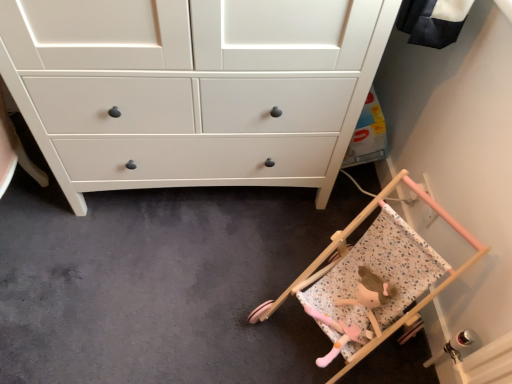
What are the coordinates of `free space behind wooden baby carriage at lower right` in the screenshot? It's located at (290, 224).